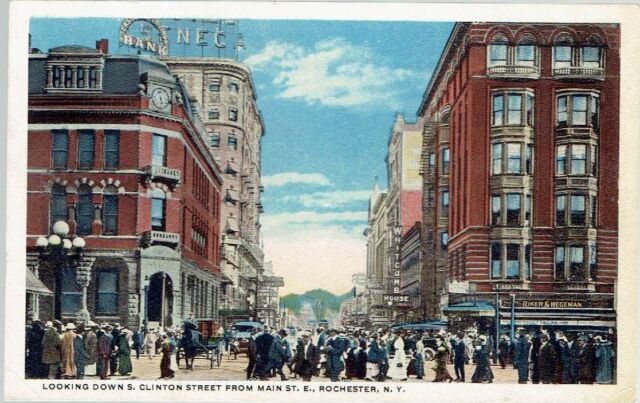
Locate an element on the screen. clock is located at coordinates [160, 99].